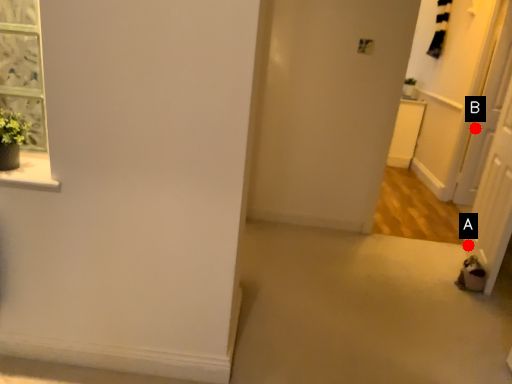
Question: Two points are circled on the image, labeled by A and B beside each circle. Which point is closer to the camera?

Choices:
 (A) A is closer
 (B) B is closer

Answer: (A)